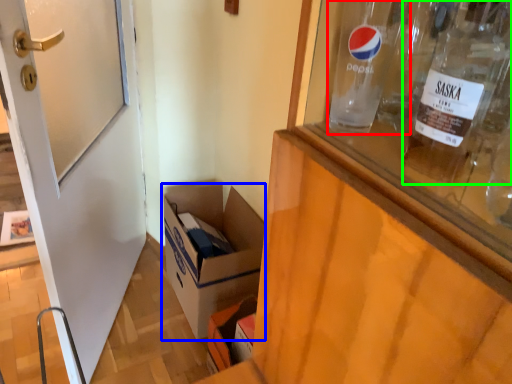
Question: Considering the real-world distances, which object is farthest from glass bottle (highlighted by a red box)? box (highlighted by a blue box) or bottle (highlighted by a green box)?

Choices:
 (A) box
 (B) bottle

Answer: (A)